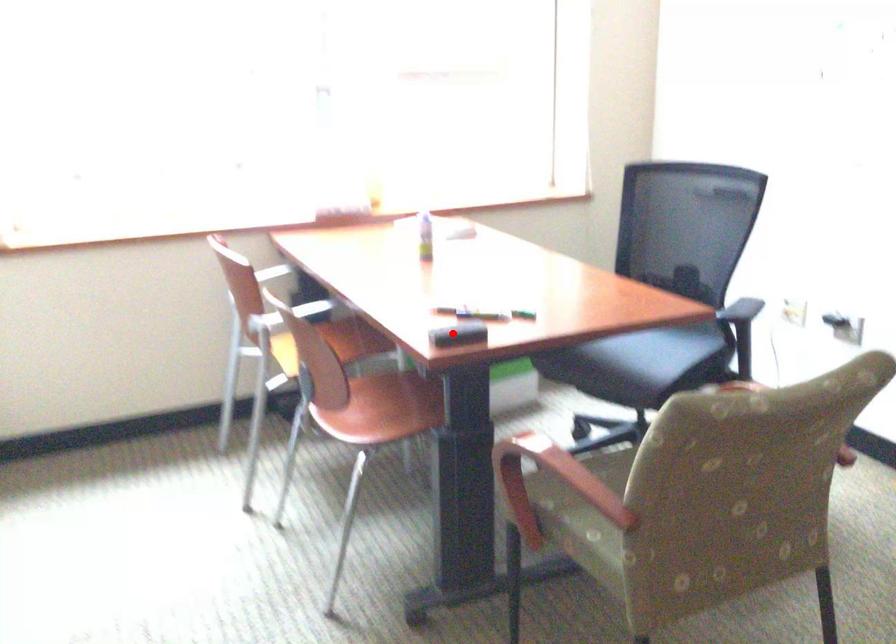
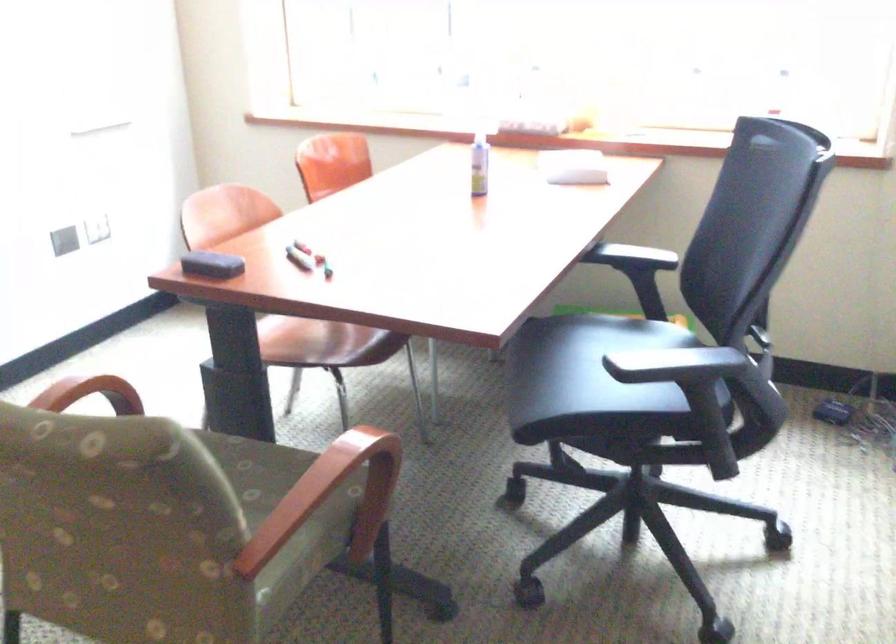
Find the pixel in the second image that matches the highlighted location in the first image.

(211, 265)